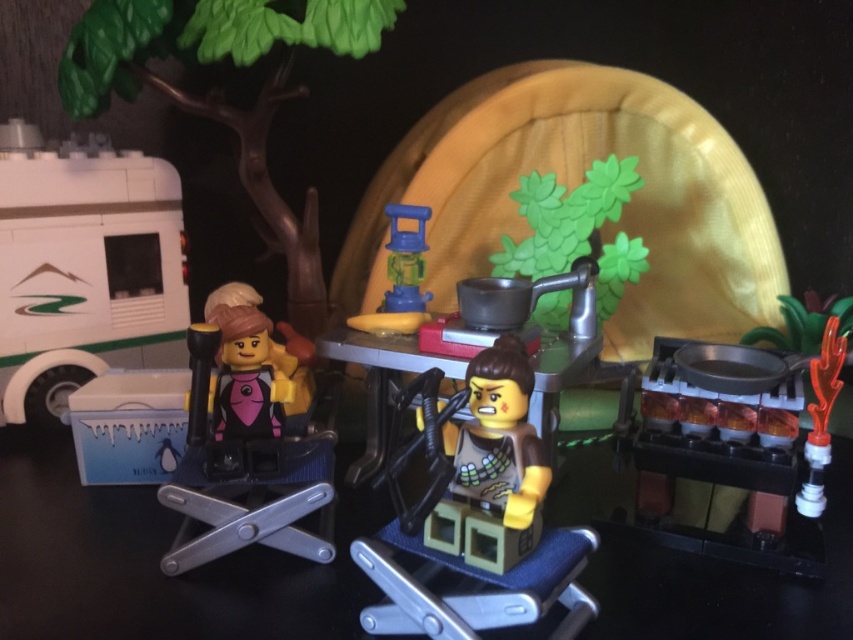
Where is the matte gray minifigure at center located in the image?

The matte gray minifigure at center is located at point coordinates of approximately 0.819 on the x axis and 0.567 on the y axis.

You are a visitor to this LEGO campsite and want to light the translucent blue plastic lantern at center. However, you need to reach it first. Can you step around the matte black minifigure at center to access the lantern?

The matte black minifigure at center is in front of the translucent blue plastic lantern at center, so you cannot step around the minifigure to access the lantern directly. You would need to move the minifigure out of the way first.